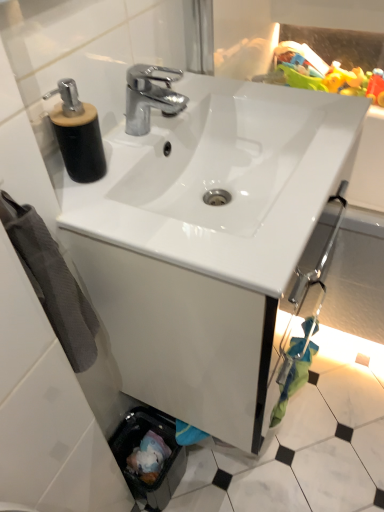
Question: Is gray cotton towel at left completely or partially outside of plastic green toy at upper right?

Choices:
 (A) yes
 (B) no

Answer: (A)

Question: Does gray cotton towel at left have a greater width compared to plastic green toy at upper right?

Choices:
 (A) yes
 (B) no

Answer: (B)

Question: Would you say gray cotton towel at left contains plastic green toy at upper right?

Choices:
 (A) no
 (B) yes

Answer: (A)

Question: Is gray cotton towel at left at the right side of plastic green toy at upper right?

Choices:
 (A) no
 (B) yes

Answer: (A)

Question: Considering the relative sizes of gray cotton towel at left and plastic green toy at upper right in the image provided, is gray cotton towel at left smaller than plastic green toy at upper right?

Choices:
 (A) no
 (B) yes

Answer: (B)

Question: Is gray cotton towel at left aimed at plastic green toy at upper right?

Choices:
 (A) yes
 (B) no

Answer: (B)

Question: Can we say plastic green toy at upper right lies outside white glossy sink at center?

Choices:
 (A) no
 (B) yes

Answer: (B)

Question: Considering the relative sizes of plastic green toy at upper right and white glossy sink at center in the image provided, is plastic green toy at upper right taller than white glossy sink at center?

Choices:
 (A) yes
 (B) no

Answer: (A)

Question: Does plastic green toy at upper right lie in front of white glossy sink at center?

Choices:
 (A) yes
 (B) no

Answer: (B)

Question: Is plastic green toy at upper right positioned far away from white glossy sink at center?

Choices:
 (A) no
 (B) yes

Answer: (A)

Question: Can you confirm if plastic green toy at upper right is smaller than white glossy sink at center?

Choices:
 (A) yes
 (B) no

Answer: (A)

Question: Could you tell me if plastic green toy at upper right is turned towards white glossy sink at center?

Choices:
 (A) yes
 (B) no

Answer: (A)

Question: Are white glossy sink at center and black matte soap dispenser at upper left located far from each other?

Choices:
 (A) yes
 (B) no

Answer: (B)